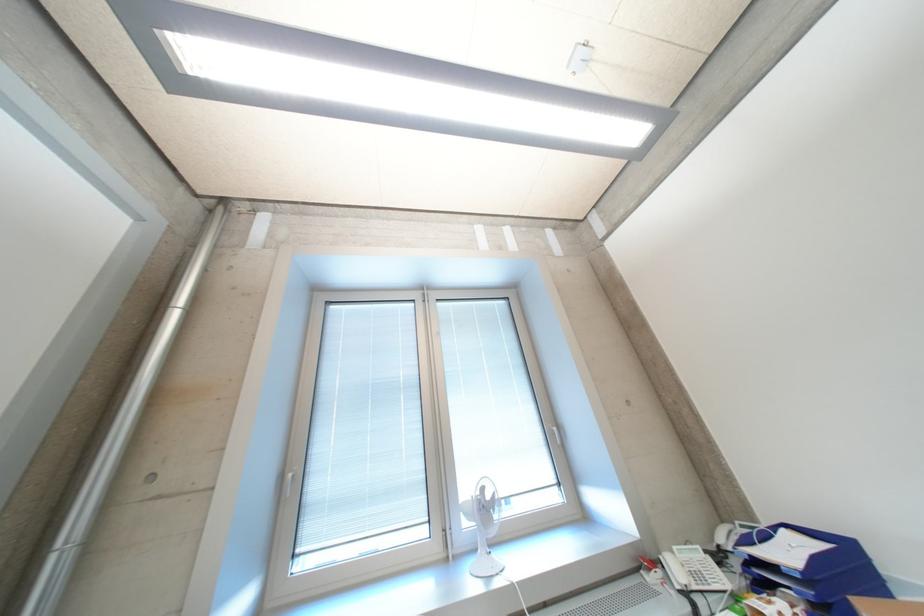
Where would you lift the white telephone handset? Please return your answer as a coordinate pair (x, y).

(714, 594)